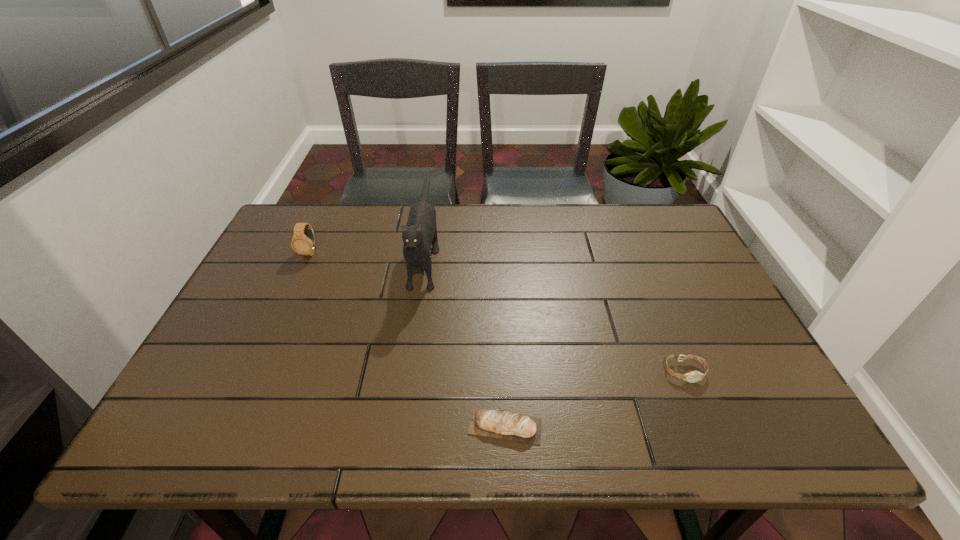
Where is `cat`? Image resolution: width=960 pixels, height=540 pixels. cat is located at coordinates (420, 232).

Locate an element on the screen. The height and width of the screenshot is (540, 960). the tallest object is located at coordinates (420, 232).

Where is `the second tallest object`? This screenshot has height=540, width=960. the second tallest object is located at coordinates (303, 242).

Locate an element on the screen. Image resolution: width=960 pixels, height=540 pixels. the leftmost object is located at coordinates (303, 242).

Image resolution: width=960 pixels, height=540 pixels. I want to click on the shorter watch, so click(x=694, y=376).

Identify the location of the right watch. This screenshot has height=540, width=960. (694, 376).

Find the location of a particular element. pita bread is located at coordinates (505, 425).

Identify the location of the nearest object. The image size is (960, 540). (505, 425).

Find the location of a particular element. Image resolution: width=960 pixels, height=540 pixels. vacant space located on the front-facing side of the cat is located at coordinates (411, 348).

Locate an element on the screen. The height and width of the screenshot is (540, 960). blank area located on the face of the farther watch is located at coordinates (283, 310).